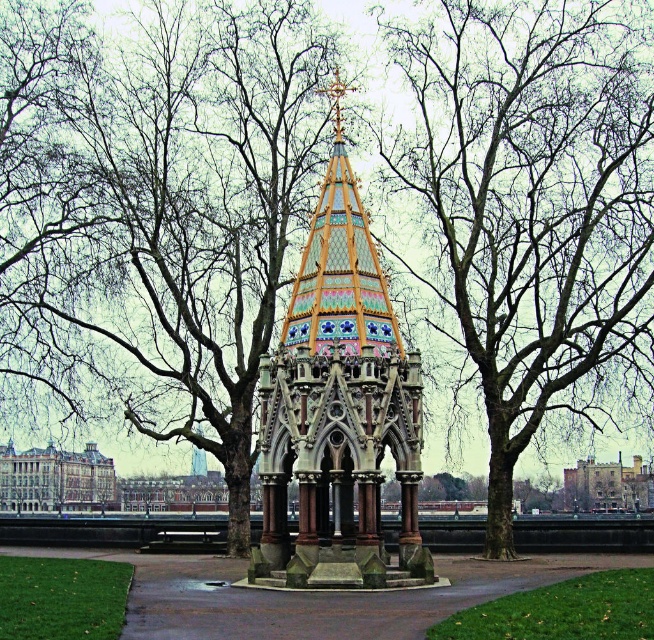
Question: Is multicolored mosaic gazebo at center positioned in front of brick stone church at center?

Choices:
 (A) no
 (B) yes

Answer: (B)

Question: Estimate the real-world distances between objects in this image. Which object is closer to the brown stone church at center?

Choices:
 (A) brick stone church at center
 (B) brown bark tree at center

Answer: (B)

Question: Can you confirm if brown bark tree at center is positioned to the right of brown stone church at center?

Choices:
 (A) yes
 (B) no

Answer: (A)

Question: Which of the following is the closest to the observer?

Choices:
 (A) (298, 381)
 (B) (604, 499)
 (C) (3, 458)
 (D) (576, 232)

Answer: (A)

Question: Observing the image, what is the correct spatial positioning of brown bark tree at center in reference to brick stone church at center?

Choices:
 (A) left
 (B) right

Answer: (A)

Question: Which point is closer to the camera?

Choices:
 (A) brown bark tree at center
 (B) brown stone church at center
 (C) multicolored mosaic gazebo at center
 (D) brick stone church at center

Answer: (C)